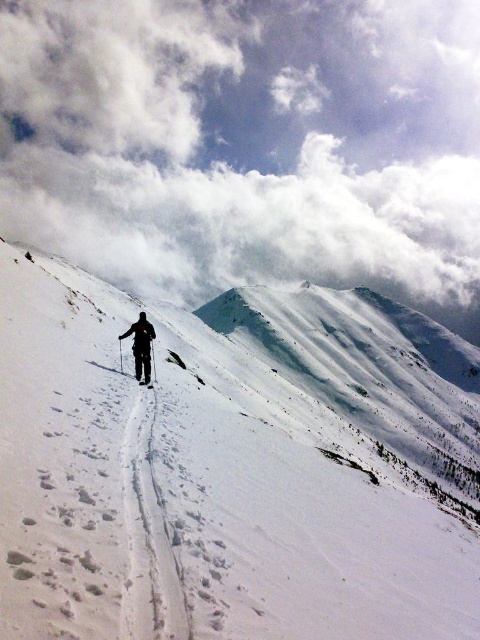
You are a photographer trying to capture the skier in the winter scene. You notice two points marked in the image. Which point, point (x=348, y=486) or point (x=151, y=385), is closer to your camera lens?

Point (x=348, y=486) is closer to the camera lens than point (x=151, y=385).

From the picture: You are a photographer trying to capture the dark gray ski suit at center and the white snow ski slope at center in a single shot. Which object will appear larger in your photo?

The white snow ski slope at center will appear larger in the photo because it is closer to the viewer than the dark gray ski suit at center.

You are a drone operator trying to capture a photo of the white snow ski slope at center. The camera is currently positioned at point A. To ensure the slope is centered in the photo, should you move the camera to the right or left? Please provide the answer based on the coordinates provided in the description.

The white snow ski slope at center is located at coordinate point (195, 490). Since the slope is already at the center point, the camera does not need to move left or right to center it in the photo.